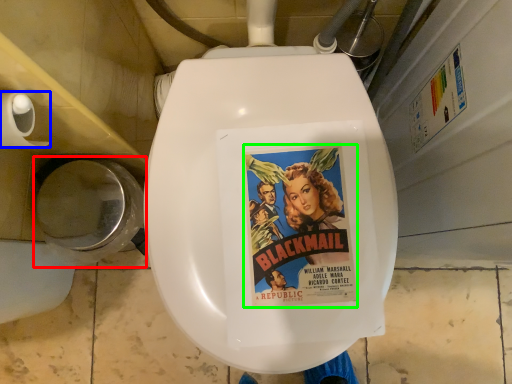
Question: Which object is positioned closest to toilet bowl (highlighted by a red box)? Select from toilet paper (highlighted by a blue box) and movie poster (highlighted by a green box).

Choices:
 (A) toilet paper
 (B) movie poster

Answer: (A)